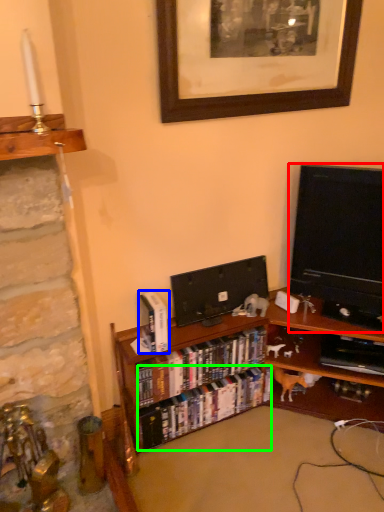
Question: Based on their relative distances, which object is nearer to television (highlighted by a red box)? Choose from book (highlighted by a blue box) and book (highlighted by a green box).

Choices:
 (A) book
 (B) book

Answer: (B)